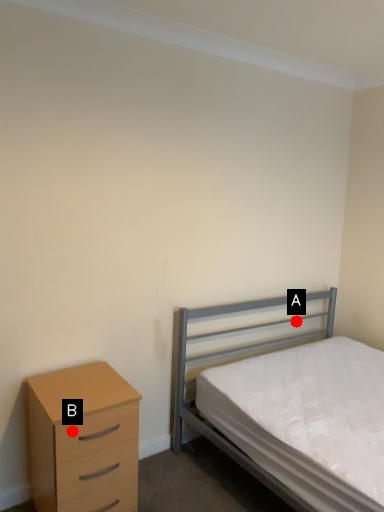
Question: Two points are circled on the image, labeled by A and B beside each circle. Which point is closer to the camera?

Choices:
 (A) A is closer
 (B) B is closer

Answer: (B)